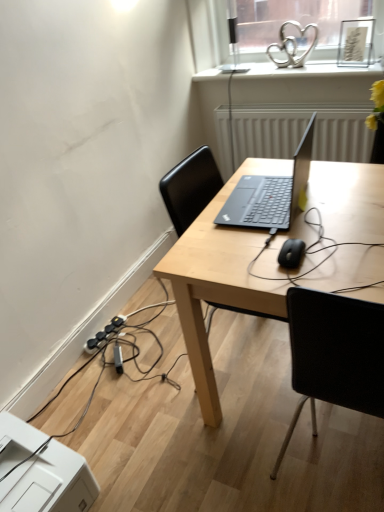
You are a GUI agent. You are given a task and a screenshot of the screen. Output one action in this format:
    pyautogui.click(x=<x>, y=<y>)
    Task: Click on the light wood desk at center
    
    Given the screenshot: What is the action you would take?
    pyautogui.click(x=219, y=280)

Describe the element at coordinates (270, 193) in the screenshot. The width and height of the screenshot is (384, 512). I see `sleek silver laptop at center` at that location.

Measure the distance between point (242, 75) and camera.

They are 7.71 feet apart.

This screenshot has width=384, height=512. What do you see at coordinates (309, 71) in the screenshot? I see `white glossy heart-shaped object at upper center` at bounding box center [309, 71].

Find the location of a particular element. Image resolution: width=384 pixels, height=512 pixels. black plastic extension cord at lower left is located at coordinates (105, 333).

Identify the location of white plastic printer at lower left. This screenshot has height=512, width=384. (50, 483).

From a real-world perspective, is sleek silver laptop at center physically above white glossy heart-shaped object at upper center?

Yes, from a real-world perspective, sleek silver laptop at center is above white glossy heart-shaped object at upper center.

Is sleek silver laptop at center facing away from white glossy heart-shaped object at upper center?

No, sleek silver laptop at center's orientation is not away from white glossy heart-shaped object at upper center.

Considering the relative sizes of sleek silver laptop at center and white glossy heart-shaped object at upper center in the image provided, is sleek silver laptop at center smaller than white glossy heart-shaped object at upper center?

Correct, sleek silver laptop at center occupies less space than white glossy heart-shaped object at upper center.

Considering the relative positions of sleek silver laptop at center and white glossy heart-shaped object at upper center in the image provided, is sleek silver laptop at center in front of white glossy heart-shaped object at upper center?

Yes, it is in front of white glossy heart-shaped object at upper center.

Which is correct: sleek silver laptop at center is inside light wood desk at center, or outside of it?

sleek silver laptop at center is located beyond the bounds of light wood desk at center.

Is point (222, 221) less distant than point (334, 193)?

Yes, it is.

From a real-world perspective, is sleek silver laptop at center positioned above or below light wood desk at center?

From a real-world perspective, sleek silver laptop at center is physically above light wood desk at center.

Considering the sizes of light wood desk at center and white textured radiator at center in the image, is light wood desk at center bigger or smaller than white textured radiator at center?

Considering their sizes, light wood desk at center takes up more space than white textured radiator at center.

Is light wood desk at center in front of or behind white textured radiator at center in the image?

Clearly, light wood desk at center is in front of white textured radiator at center.

From the image's perspective, is light wood desk at center located above or below white textured radiator at center?

Clearly, from the image's perspective, light wood desk at center is below white textured radiator at center.

What's the angular difference between light wood desk at center and white textured radiator at center's facing directions?

They differ by 1.62 degrees in their facing directions.

Considering the relative sizes of white plastic printer at lower left and white textured radiator at center in the image provided, is white plastic printer at lower left bigger than white textured radiator at center?

No.

Is white plastic printer at lower left facing away from white textured radiator at center?

That's not correct — white plastic printer at lower left is not looking away from white textured radiator at center.

From the image's perspective, who appears lower, white plastic printer at lower left or white textured radiator at center?

white plastic printer at lower left is shown below in the image.

Which is behind, white plastic printer at lower left or white textured radiator at center?

white textured radiator at center.

In the image, is black matte mouse at center positioned in front of or behind light wood desk at center?

In the image, black matte mouse at center appears behind light wood desk at center.

Who is shorter, black matte mouse at center or light wood desk at center?

black matte mouse at center is shorter.

How different are the orientations of black matte mouse at center and light wood desk at center in degrees?

2.9 degrees separate the facing orientations of black matte mouse at center and light wood desk at center.

Considering the relative sizes of black matte mouse at center and light wood desk at center in the image provided, is black matte mouse at center thinner than light wood desk at center?

Yes.

Considering the sizes of objects white glossy heart-shaped object at upper center and sleek silver laptop at center in the image provided, who is smaller, white glossy heart-shaped object at upper center or sleek silver laptop at center?

With smaller size is sleek silver laptop at center.

Is white glossy heart-shaped object at upper center located outside sleek silver laptop at center?

Yes, white glossy heart-shaped object at upper center is located beyond the bounds of sleek silver laptop at center.

You are a GUI agent. You are given a task and a screenshot of the screen. Output one action in this format:
    pyautogui.click(x=<x>, y=<y>)
    Task: Click on the laptop in front of the white glossy heart-shaped object at upper center
    
    Given the screenshot: What is the action you would take?
    pyautogui.click(x=270, y=193)

Considering the points (332, 64) and (257, 214), which point is in front, point (332, 64) or point (257, 214)?

Point (257, 214)

Based on the photo, considering the sizes of objects white plastic printer at lower left and black plastic extension cord at lower left in the image provided, who is smaller, white plastic printer at lower left or black plastic extension cord at lower left?

Smaller between the two is black plastic extension cord at lower left.

You are a GUI agent. You are given a task and a screenshot of the screen. Output one action in this format:
    pyautogui.click(x=<x>, y=<y>)
    Task: Click on the printer on the left of the black plastic extension cord at lower left
    The width and height of the screenshot is (384, 512).
    Given the screenshot: What is the action you would take?
    pyautogui.click(x=50, y=483)

Which is correct: white plastic printer at lower left is inside black plastic extension cord at lower left, or outside of it?

white plastic printer at lower left is spatially situated outside black plastic extension cord at lower left.

Where is `window sill on the right side of sleek silver laptop at center`? window sill on the right side of sleek silver laptop at center is located at coordinates (309, 71).

The height and width of the screenshot is (512, 384). I want to click on desk in front of the sleek silver laptop at center, so click(x=219, y=280).

Estimate the real-world distances between objects in this image. Which object is closer to white plastic printer at lower left, light wood desk at center or sleek silver laptop at center?

light wood desk at center lies closer to white plastic printer at lower left than the other object.

Looking at the image, which one is located further to sleek silver laptop at center, white glossy heart-shaped object at upper center or black plastic extension cord at lower left?

Among the two, white glossy heart-shaped object at upper center is located further to sleek silver laptop at center.

Estimate the real-world distances between objects in this image. Which object is closer to white textured radiator at center, sleek silver laptop at center or black plastic extension cord at lower left?

sleek silver laptop at center lies closer to white textured radiator at center than the other object.

Based on the photo, which object lies nearer to the anchor point light wood desk at center, sleek silver laptop at center or black matte mouse at center?

sleek silver laptop at center is closer to light wood desk at center.

Considering their positions, is white plastic printer at lower left positioned closer to light wood desk at center than sleek silver laptop at center?

The object closer to light wood desk at center is sleek silver laptop at center.

Considering their positions, is black matte mouse at center positioned closer to sleek silver laptop at center than light wood desk at center?

Among the two, light wood desk at center is located nearer to sleek silver laptop at center.

Which object lies further to the anchor point black matte mouse at center, light wood desk at center or black plastic extension cord at lower left?

black plastic extension cord at lower left is positioned further to the anchor black matte mouse at center.

Based on their spatial positions, is black plastic extension cord at lower left or white glossy heart-shaped object at upper center closer to black matte mouse at center?

black plastic extension cord at lower left is positioned closer to the anchor black matte mouse at center.

Where is `window sill positioned between black matte mouse at center and white textured radiator at center from near to far`? Image resolution: width=384 pixels, height=512 pixels. window sill positioned between black matte mouse at center and white textured radiator at center from near to far is located at coordinates (309, 71).

The height and width of the screenshot is (512, 384). I want to click on mouse situated between white plastic printer at lower left and light wood desk at center from left to right, so click(291, 253).

Where is `printer between light wood desk at center and black plastic extension cord at lower left from front to back`? printer between light wood desk at center and black plastic extension cord at lower left from front to back is located at coordinates (50, 483).

Where is `mouse between sleek silver laptop at center and white plastic printer at lower left in the vertical direction`? mouse between sleek silver laptop at center and white plastic printer at lower left in the vertical direction is located at coordinates (291, 253).